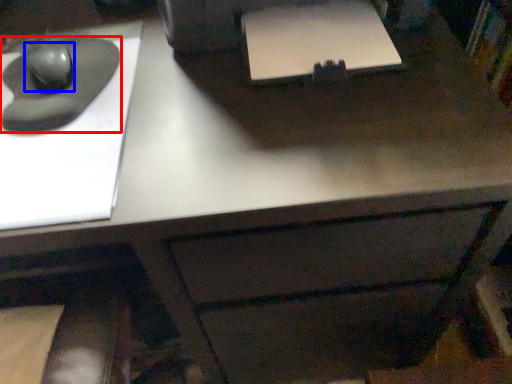
Question: Which object appears farthest to the camera in this image, mouse (highlighted by a red box) or mouse (highlighted by a blue box)?

Choices:
 (A) mouse
 (B) mouse

Answer: (B)